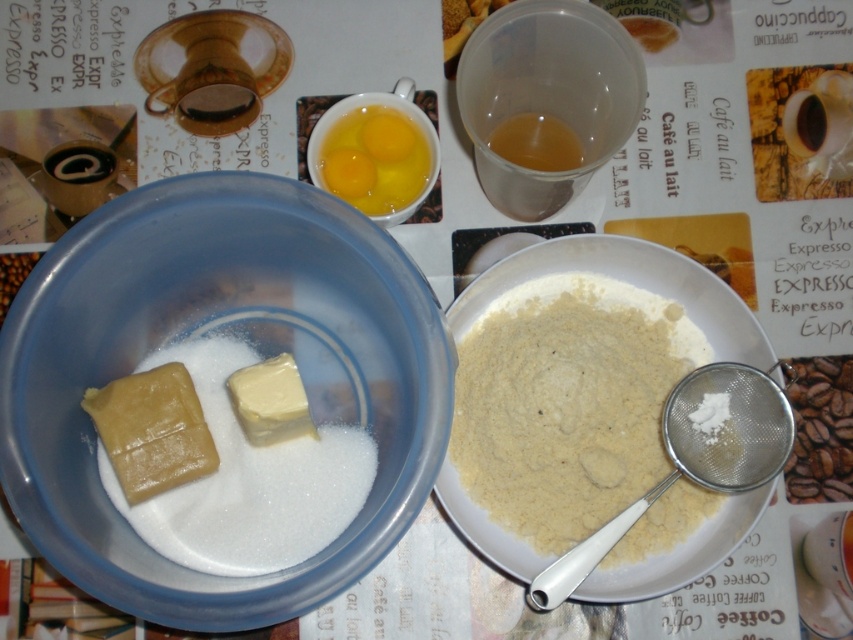
You are a chef trying to locate two specific points in the kitchen scene. The first point is at coordinate point(479, 488) and the second is at point(213, 392). Which point is closer to you?

Point(479, 488) is closer to you than point(213, 392) because it is further to the camera.

You are a baker preparing a cake and need to access both the white plastic bowl at center and the white powder at left. Which item will you reach first if you are approaching from the front of the image?

The white plastic bowl at center will be reached first because it is closer to the viewer than the white powder at left.